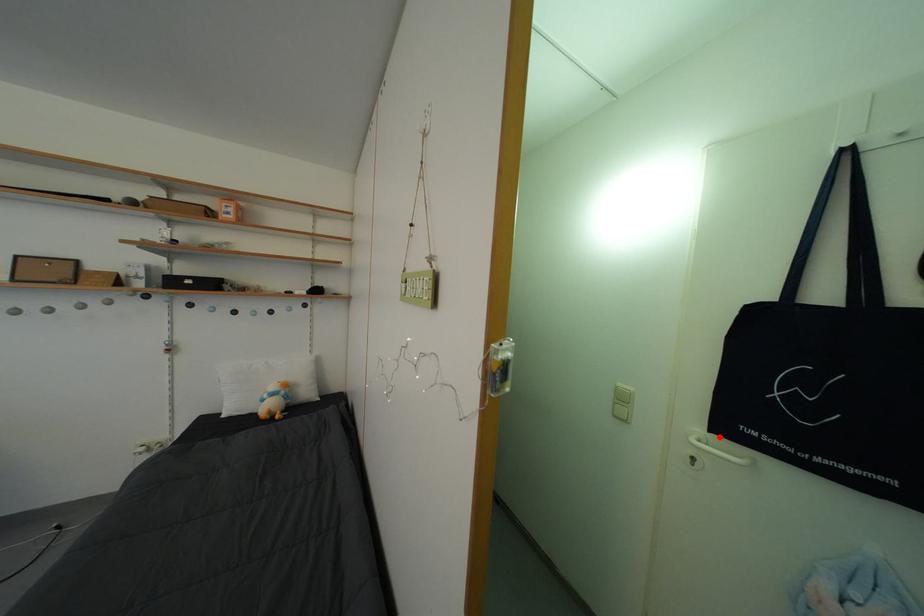
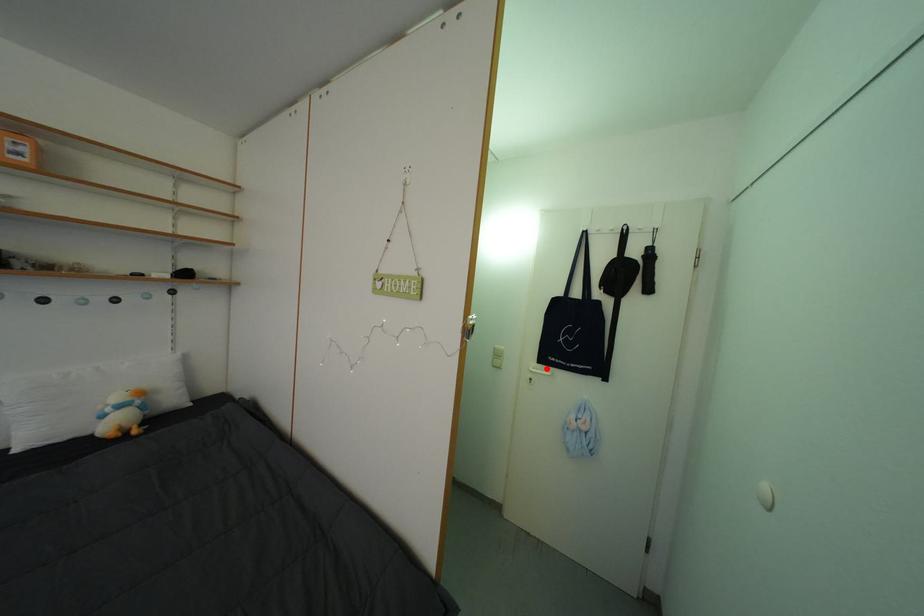
I am providing you with two images of the same scene from different viewpoints. A red point is marked on the first image and another point is marked on the second image. Do the highlighted points in image1 and image2 indicate the same real-world spot?

Yes